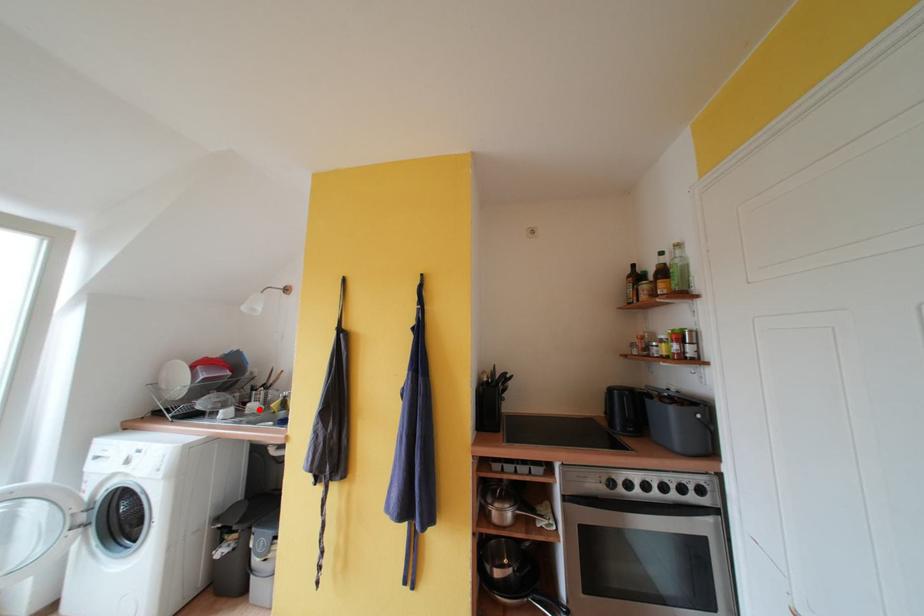
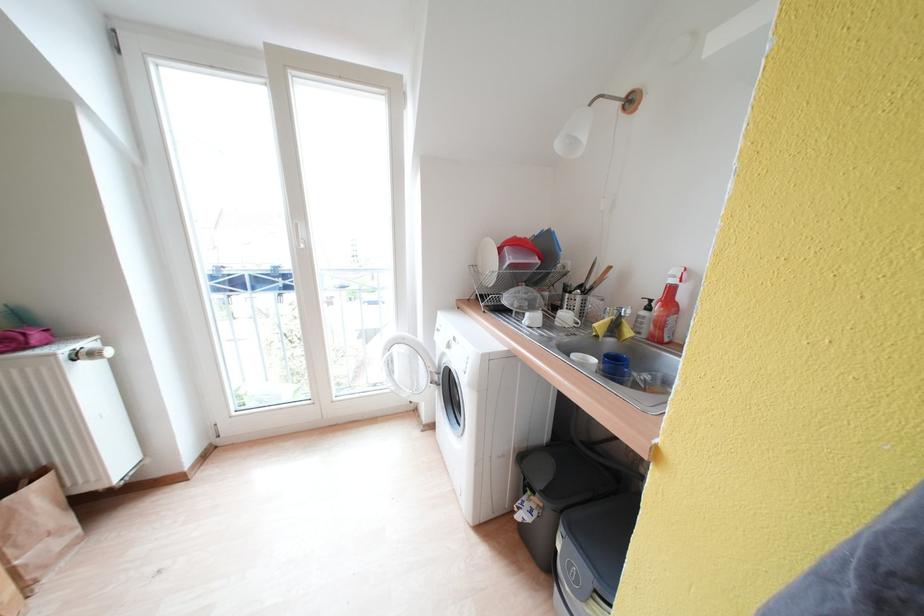
Question: I am providing you with two images of the same scene from different viewpoints. In image1, a red point is highlighted. Considering the same 3D point in image2, which of the following is correct?

Choices:
 (A) It is closer
 (B) It is farther

Answer: (A)